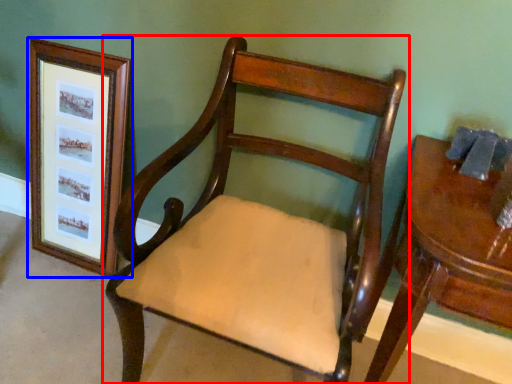
Question: Among these objects, which one is nearest to the camera, chair (highlighted by a red box) or picture frame (highlighted by a blue box)?

Choices:
 (A) chair
 (B) picture frame

Answer: (A)